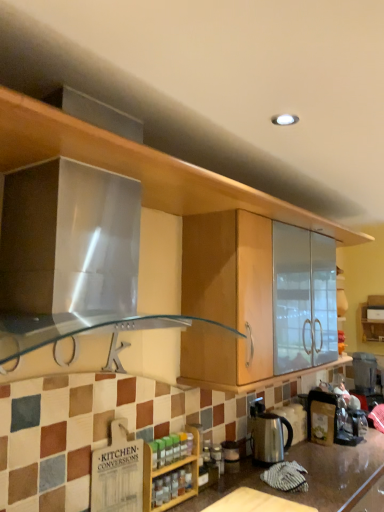
Question: Relative to wooden spice rack at lower center, is wooden cutting board at lower center in front or behind?

Choices:
 (A) front
 (B) behind

Answer: (A)

Question: Looking at the image, does wooden cutting board at lower center seem bigger or smaller compared to wooden spice rack at lower center?

Choices:
 (A) small
 (B) big

Answer: (A)

Question: Which object is positioned closest to the wooden spice rack at lower center?

Choices:
 (A) polished stainless steel kettle at center
 (B) wooden cutting board at lower center

Answer: (B)

Question: Which object is the farthest from the wooden spice rack at lower center?

Choices:
 (A) wooden cutting board at lower center
 (B) polished stainless steel kettle at center

Answer: (B)